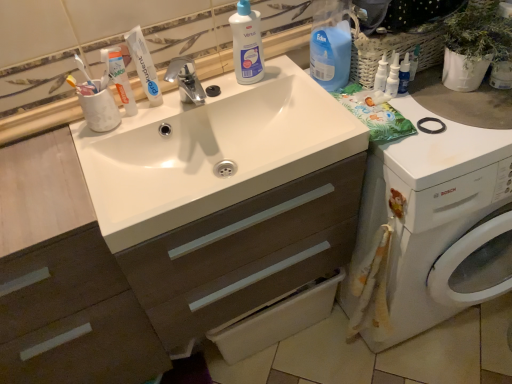
Question: Would you consider blue plastic bottle at upper right, acting as the second cleaning product starting from the left, to be distant from yellow-bristled toothbrush at upper left?

Choices:
 (A) yes
 (B) no

Answer: (B)

Question: Is blue plastic bottle at upper right, acting as the third cleaning product starting from the right, wider than yellow-bristled toothbrush at upper left?

Choices:
 (A) yes
 (B) no

Answer: (A)

Question: Considering the relative sizes of blue plastic bottle at upper right, acting as the second cleaning product starting from the left, and yellow-bristled toothbrush at upper left in the image provided, is blue plastic bottle at upper right, acting as the second cleaning product starting from the left, taller than yellow-bristled toothbrush at upper left?

Choices:
 (A) no
 (B) yes

Answer: (B)

Question: Considering the relative sizes of blue plastic bottle at upper right, acting as the third cleaning product starting from the right, and yellow-bristled toothbrush at upper left in the image provided, is blue plastic bottle at upper right, acting as the third cleaning product starting from the right, shorter than yellow-bristled toothbrush at upper left?

Choices:
 (A) yes
 (B) no

Answer: (B)

Question: From a real-world perspective, is blue plastic bottle at upper right, acting as the second cleaning product starting from the left, on top of yellow-bristled toothbrush at upper left?

Choices:
 (A) no
 (B) yes

Answer: (A)

Question: From the image's perspective, is blue plastic bottle at upper right, acting as the third cleaning product starting from the right, under yellow-bristled toothbrush at upper left?

Choices:
 (A) yes
 (B) no

Answer: (B)

Question: Does white glossy bottle at upper center, marked as the first cleaning product in a left-to-right arrangement, come in front of white glossy sink at center?

Choices:
 (A) no
 (B) yes

Answer: (A)

Question: Are white glossy bottle at upper center, marked as the first cleaning product in a left-to-right arrangement, and white glossy sink at center beside each other?

Choices:
 (A) yes
 (B) no

Answer: (B)

Question: From a real-world perspective, is white glossy bottle at upper center, arranged as the fourth cleaning product when viewed from the right, located higher than white glossy sink at center?

Choices:
 (A) no
 (B) yes

Answer: (B)

Question: Considering the relative sizes of white glossy bottle at upper center, marked as the first cleaning product in a left-to-right arrangement, and white glossy sink at center in the image provided, is white glossy bottle at upper center, marked as the first cleaning product in a left-to-right arrangement, thinner than white glossy sink at center?

Choices:
 (A) no
 (B) yes

Answer: (B)

Question: Is white glossy bottle at upper center, arranged as the fourth cleaning product when viewed from the right, smaller than white glossy sink at center?

Choices:
 (A) no
 (B) yes

Answer: (B)

Question: Is white glossy bottle at upper center, arranged as the fourth cleaning product when viewed from the right, to the left of white glossy sink at center from the viewer's perspective?

Choices:
 (A) yes
 (B) no

Answer: (B)

Question: Considering the relative sizes of white glossy toothpaste at upper left and white glossy bottle at upper center, marked as the first cleaning product in a left-to-right arrangement, in the image provided, is white glossy toothpaste at upper left taller than white glossy bottle at upper center, marked as the first cleaning product in a left-to-right arrangement,?

Choices:
 (A) no
 (B) yes

Answer: (A)